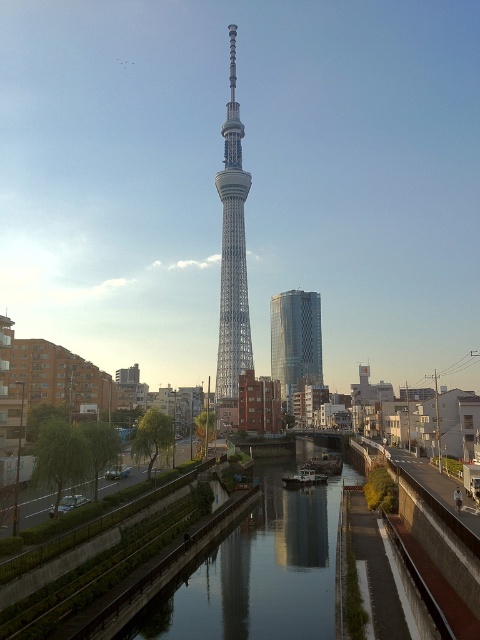
Question: Is smooth concrete canal at center smaller than silver metallic tower at center?

Choices:
 (A) yes
 (B) no

Answer: (A)

Question: From the image, what is the correct spatial relationship of silver metallic tower at center in relation to shiny glass skyscraper at center?

Choices:
 (A) right
 (B) left

Answer: (B)

Question: Among these objects, which one is nearest to the camera?

Choices:
 (A) shiny glass skyscraper at center
 (B) silver metallic tower at center

Answer: (B)

Question: Which is nearer to the smooth concrete canal at center?

Choices:
 (A) shiny glass skyscraper at center
 (B) silver metallic tower at center

Answer: (B)

Question: Among these points, which one is nearest to the camera?

Choices:
 (A) (276, 477)
 (B) (235, 48)

Answer: (A)

Question: Can you confirm if smooth concrete canal at center is smaller than shiny glass skyscraper at center?

Choices:
 (A) no
 (B) yes

Answer: (B)